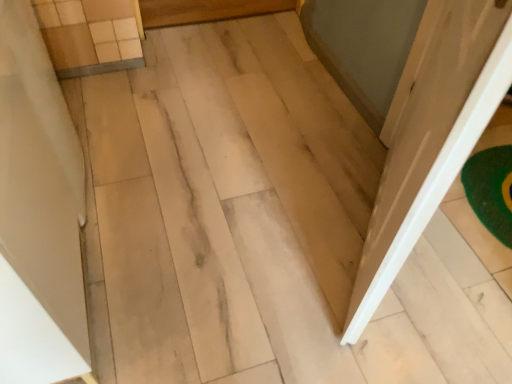
I want to click on vacant space to the right of white wood door at right, so click(466, 237).